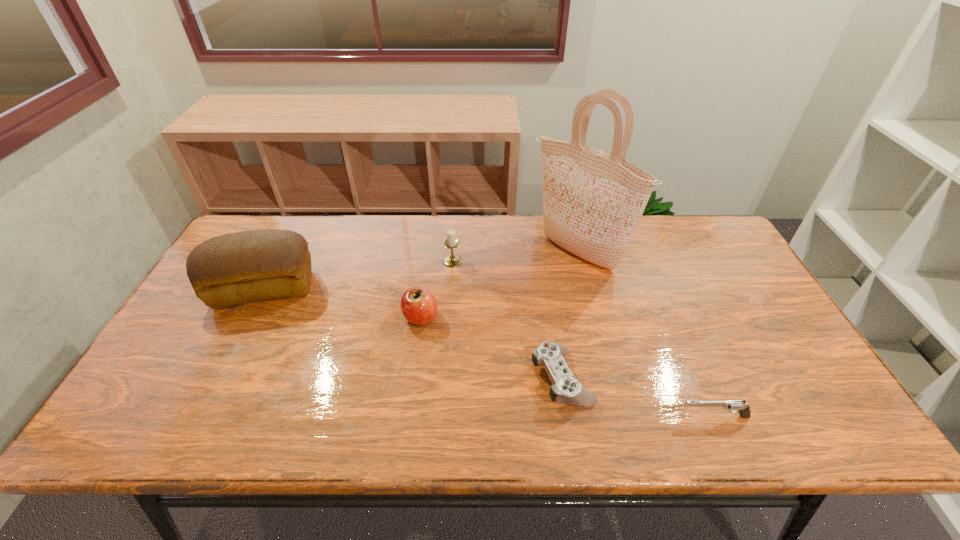
You are a GUI agent. You are given a task and a screenshot of the screen. Output one action in this format:
    pyautogui.click(x=<x>, y=<y>)
    Task: Click on the shopping bag
    
    Given the screenshot: What is the action you would take?
    pyautogui.click(x=592, y=202)

Image resolution: width=960 pixels, height=540 pixels. Find the location of `the leftmost object`. the leftmost object is located at coordinates (229, 270).

The image size is (960, 540). I want to click on bread, so click(229, 270).

Locate an element on the screen. the third tallest object is located at coordinates (451, 242).

This screenshot has height=540, width=960. I want to click on apple, so click(418, 305).

Identify the location of pistol. (734, 406).

The width and height of the screenshot is (960, 540). I want to click on the fifth farthest object, so pos(566,389).

Find the location of a particular element. The image size is (960, 540). free space located 0.150m on the right of the shopping bag is located at coordinates (669, 253).

At what (x,y) coordinates should I click in order to perform the action: click on blank area located 0.280m on the right of the leftmost object. Please return your answer as a coordinate pair (x, y). The height and width of the screenshot is (540, 960). Looking at the image, I should click on (413, 289).

The width and height of the screenshot is (960, 540). I want to click on vacant space located on the left of the candle holder, so click(x=347, y=261).